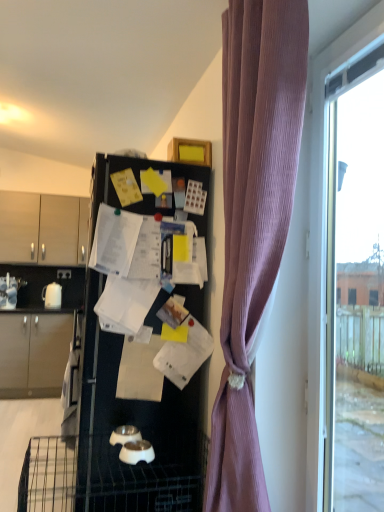
Measure the distance between matte wood cabinets at left, acting as the 2th cabinetry starting from the bottom, and camera.

matte wood cabinets at left, acting as the 2th cabinetry starting from the bottom, is 4.43 meters away from camera.

How much space does matte wood cabinets at left, placed as the 1th cabinetry when sorted from top to bottom, occupy vertically?

matte wood cabinets at left, placed as the 1th cabinetry when sorted from top to bottom, is 78.16 centimeters in height.

Describe the element at coordinates (52, 296) in the screenshot. I see `white glossy kettle at left` at that location.

You are a GUI agent. You are given a task and a screenshot of the screen. Output one action in this format:
    pyautogui.click(x=<x>, y=<y>)
    Task: Click on the white glossy kettle at left
    This screenshot has width=384, height=512.
    Given the screenshot: What is the action you would take?
    pyautogui.click(x=52, y=296)

This screenshot has width=384, height=512. What do you see at coordinates (253, 221) in the screenshot? I see `purple ribbed curtain at right` at bounding box center [253, 221].

This screenshot has height=512, width=384. What do you see at coordinates (138, 426) in the screenshot? I see `black matte refrigerator at center` at bounding box center [138, 426].

At what (x,y) coordinates should I click in order to perform the action: click on matte wood cabinets at left, placed as the 1th cabinetry when sorted from top to bottom. Please return your answer as a coordinate pair (x, y). Image resolution: width=384 pixels, height=512 pixels. Looking at the image, I should click on (43, 228).

How distant is transparent glass window at right from matte beige cabinet at left, arranged as the 2th cabinetry when viewed from the top?

transparent glass window at right and matte beige cabinet at left, arranged as the 2th cabinetry when viewed from the top, are 10.89 feet apart from each other.

Based on their positions, is transparent glass window at right located to the left or right of matte beige cabinet at left, positioned as the 1th cabinetry in bottom-to-top order?

transparent glass window at right is positioned on matte beige cabinet at left, positioned as the 1th cabinetry in bottom-to-top order,'s right side.

Considering the points (317, 450) and (38, 348), which point is behind, point (317, 450) or point (38, 348)?

The point (38, 348) is farther.

From the picture: Considering the sizes of objects transparent glass window at right and matte beige cabinet at left, arranged as the 2th cabinetry when viewed from the top, in the image provided, who is shorter, transparent glass window at right or matte beige cabinet at left, arranged as the 2th cabinetry when viewed from the top,?

matte beige cabinet at left, arranged as the 2th cabinetry when viewed from the top, is shorter.

Considering the relative sizes of transparent glass window at right and matte wood cabinets at left, acting as the 2th cabinetry starting from the bottom, in the image provided, is transparent glass window at right shorter than matte wood cabinets at left, acting as the 2th cabinetry starting from the bottom,?

No, transparent glass window at right is not shorter than matte wood cabinets at left, acting as the 2th cabinetry starting from the bottom.

How many degrees apart are the facing directions of transparent glass window at right and matte wood cabinets at left, acting as the 2th cabinetry starting from the bottom?

The angle between the facing direction of transparent glass window at right and the facing direction of matte wood cabinets at left, acting as the 2th cabinetry starting from the bottom, is 89.5 degrees.

In the scene shown: Are transparent glass window at right and matte wood cabinets at left, acting as the 2th cabinetry starting from the bottom, located far from each other?

Yes, transparent glass window at right is far from matte wood cabinets at left, acting as the 2th cabinetry starting from the bottom.

From the image's perspective, would you say transparent glass window at right is positioned over matte wood cabinets at left, placed as the 1th cabinetry when sorted from top to bottom?

Incorrect, from the image's perspective, transparent glass window at right is lower than matte wood cabinets at left, placed as the 1th cabinetry when sorted from top to bottom.

Is point (16, 216) positioned after point (97, 334)?

Yes, it is.

Does matte wood cabinets at left, acting as the 2th cabinetry starting from the bottom, have a lesser height compared to black matte refrigerator at center?

Indeed, matte wood cabinets at left, acting as the 2th cabinetry starting from the bottom, has a lesser height compared to black matte refrigerator at center.

From a real-world perspective, who is located higher, matte wood cabinets at left, acting as the 2th cabinetry starting from the bottom, or black matte refrigerator at center?

In real-world perspective, matte wood cabinets at left, acting as the 2th cabinetry starting from the bottom, is above.

From the image's perspective, is matte wood cabinets at left, acting as the 2th cabinetry starting from the bottom, beneath black matte refrigerator at center?

No, from the image's perspective, matte wood cabinets at left, acting as the 2th cabinetry starting from the bottom, is not beneath black matte refrigerator at center.

What's the angular difference between black matte refrigerator at center and matte beige cabinet at left, arranged as the 2th cabinetry when viewed from the top,'s facing directions?

The facing directions of black matte refrigerator at center and matte beige cabinet at left, arranged as the 2th cabinetry when viewed from the top, are 89.2 degrees apart.

Is matte beige cabinet at left, positioned as the 1th cabinetry in bottom-to-top order, inside black matte refrigerator at center?

Definitely not — matte beige cabinet at left, positioned as the 1th cabinetry in bottom-to-top order, is not inside black matte refrigerator at center.

From the image's perspective, is black matte refrigerator at center above or below matte beige cabinet at left, arranged as the 2th cabinetry when viewed from the top?

Clearly, from the image's perspective, black matte refrigerator at center is above matte beige cabinet at left, arranged as the 2th cabinetry when viewed from the top.

In the scene shown: Which is nearer, (56, 308) or (147, 203)?

Point (56, 308) is positioned farther from the camera compared to point (147, 203).

From the image's perspective, which one is positioned lower, white glossy kettle at left or black matte refrigerator at center?

black matte refrigerator at center.

Does white glossy kettle at left have a smaller size compared to black matte refrigerator at center?

Correct, white glossy kettle at left occupies less space than black matte refrigerator at center.

How different are the orientations of black matte refrigerator at center and purple ribbed curtain at right in degrees?

3.39 degrees separate the facing orientations of black matte refrigerator at center and purple ribbed curtain at right.

Consider the image. Is black matte refrigerator at center not inside purple ribbed curtain at right?

A: Yes, black matte refrigerator at center is located beyond the bounds of purple ribbed curtain at right.

Can you confirm if black matte refrigerator at center is wider than purple ribbed curtain at right?

Yes.

Does point (100, 372) lie in front of point (226, 474)?

No, it is behind (226, 474).

Are matte beige cabinet at left, arranged as the 2th cabinetry when viewed from the top, and white glossy kettle at left far apart?

A: No, matte beige cabinet at left, arranged as the 2th cabinetry when viewed from the top, is not far from white glossy kettle at left.

From the picture: Is white glossy kettle at left a part of matte beige cabinet at left, arranged as the 2th cabinetry when viewed from the top?

No.

In order to click on cabinetry lying below the white glossy kettle at left (from the image's perspective) in this screenshot , I will do `click(34, 354)`.

Find the location of `window above the matte beige cabinet at left, positioned as the 1th cabinetry in bottom-to-top order (from a real-world perspective)`. window above the matte beige cabinet at left, positioned as the 1th cabinetry in bottom-to-top order (from a real-world perspective) is located at coordinates (325, 230).

You are a GUI agent. You are given a task and a screenshot of the screen. Output one action in this format:
    pyautogui.click(x=<x>, y=<y>)
    Task: Click on the 2nd cabinetry behind when counting from the transparent glass window at right
    
    Given the screenshot: What is the action you would take?
    pyautogui.click(x=43, y=228)

Looking at the image, which one is located closer to purple ribbed curtain at right, matte wood cabinets at left, acting as the 2th cabinetry starting from the bottom, or white glossy kettle at left?

white glossy kettle at left.

Estimate the real-world distances between objects in this image. Which object is closer to purple ribbed curtain at right, black matte refrigerator at center or white glossy kettle at left?

Among the two, black matte refrigerator at center is located nearer to purple ribbed curtain at right.

From the picture: Looking at the image, which one is located further to purple ribbed curtain at right, matte wood cabinets at left, placed as the 1th cabinetry when sorted from top to bottom, or black matte refrigerator at center?

matte wood cabinets at left, placed as the 1th cabinetry when sorted from top to bottom, is further to purple ribbed curtain at right.

From the image, which object appears to be farther from matte beige cabinet at left, positioned as the 1th cabinetry in bottom-to-top order, transparent glass window at right or matte wood cabinets at left, placed as the 1th cabinetry when sorted from top to bottom?

Among the two, transparent glass window at right is located further to matte beige cabinet at left, positioned as the 1th cabinetry in bottom-to-top order.

From the image, which object appears to be farther from transparent glass window at right, purple ribbed curtain at right or white glossy kettle at left?

white glossy kettle at left is further to transparent glass window at right.

From the picture: Estimate the real-world distances between objects in this image. Which object is closer to matte wood cabinets at left, acting as the 2th cabinetry starting from the bottom, black matte refrigerator at center or matte beige cabinet at left, positioned as the 1th cabinetry in bottom-to-top order?

The object closer to matte wood cabinets at left, acting as the 2th cabinetry starting from the bottom, is matte beige cabinet at left, positioned as the 1th cabinetry in bottom-to-top order.

From the image, which object appears to be farther from matte beige cabinet at left, positioned as the 1th cabinetry in bottom-to-top order, black matte refrigerator at center or purple ribbed curtain at right?

purple ribbed curtain at right lies further to matte beige cabinet at left, positioned as the 1th cabinetry in bottom-to-top order, than the other object.

From the picture: Looking at the image, which one is located closer to matte wood cabinets at left, acting as the 2th cabinetry starting from the bottom, black matte refrigerator at center or white glossy kettle at left?

The object closer to matte wood cabinets at left, acting as the 2th cabinetry starting from the bottom, is white glossy kettle at left.

Identify the location of curtain between transparent glass window at right and white glossy kettle at left from front to back. (253, 221).

You are a GUI agent. You are given a task and a screenshot of the screen. Output one action in this format:
    pyautogui.click(x=<x>, y=<y>)
    Task: Click on the refrigerator positioned between purple ribbed curtain at right and matte wood cabinets at left, acting as the 2th cabinetry starting from the bottom, from near to far
    Image resolution: width=384 pixels, height=512 pixels.
    Given the screenshot: What is the action you would take?
    pyautogui.click(x=138, y=426)

Where is `curtain between transparent glass window at right and matte beige cabinet at left, positioned as the 1th cabinetry in bottom-to-top order, along the z-axis`? The height and width of the screenshot is (512, 384). curtain between transparent glass window at right and matte beige cabinet at left, positioned as the 1th cabinetry in bottom-to-top order, along the z-axis is located at coordinates (253, 221).

Image resolution: width=384 pixels, height=512 pixels. I want to click on appliance between matte wood cabinets at left, acting as the 2th cabinetry starting from the bottom, and matte beige cabinet at left, positioned as the 1th cabinetry in bottom-to-top order, in the up-down direction, so (52, 296).